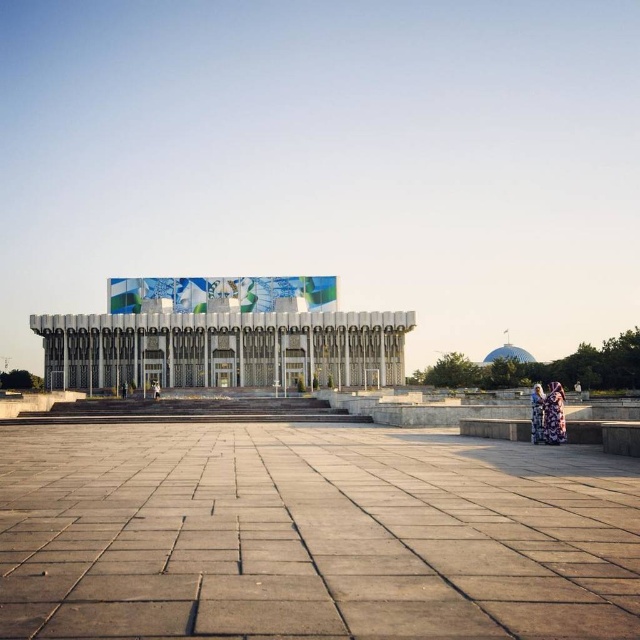
You are standing in the plaza and want to walk towards the floral dress at lower right. Which direction should you move relative to the gray concrete plaza at center?

You should move to the right of the gray concrete plaza at center to reach the floral dress at lower right since the plaza is positioned to the left of the dress.

You are standing in the plaza and want to take a photo of the white glossy building at center. If your camera can focus on objects up to 100 meters away, will you need to move closer to ensure the building is in focus?

The white glossy building at center is 128.24 meters away from you, which exceeds the camera focus limit of 100 meters. You need to move closer to ensure the building is in focus.